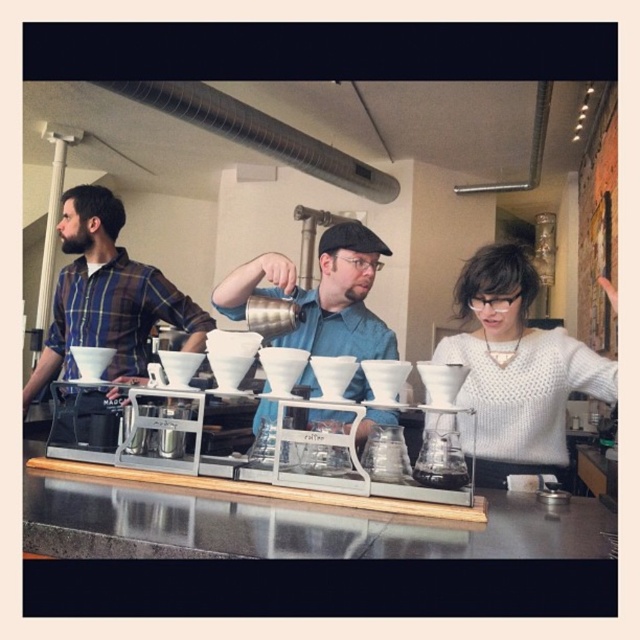
The width and height of the screenshot is (640, 640). What do you see at coordinates (321, 296) in the screenshot?
I see `matte silver kettle at center` at bounding box center [321, 296].

Does matte silver kettle at center have a greater height compared to black matte exhaust hood at upper center?

Indeed, matte silver kettle at center has a greater height compared to black matte exhaust hood at upper center.

The height and width of the screenshot is (640, 640). What do you see at coordinates (321, 296) in the screenshot?
I see `matte silver kettle at center` at bounding box center [321, 296].

Locate an element on the screen. The image size is (640, 640). matte silver kettle at center is located at coordinates (321, 296).

The height and width of the screenshot is (640, 640). What do you see at coordinates (332, 184) in the screenshot?
I see `transparent glass carafe at center` at bounding box center [332, 184].

Who is more forward, [225,209] or [392,330]?

Positioned in front is point [392,330].

Who is more distant from viewer, [460,227] or [236,289]?

The point [460,227] is behind.

Find the location of a particular element. The image size is (640, 640). transparent glass carafe at center is located at coordinates (332, 184).

Does point (438, 134) come closer to viewer compared to point (504, 378)?

No.

Which is in front, point (417, 100) or point (481, 458)?

Positioned in front is point (481, 458).

What do you see at coordinates (332, 184) in the screenshot? I see `transparent glass carafe at center` at bounding box center [332, 184].

Where is `transparent glass carafe at center`? The height and width of the screenshot is (640, 640). transparent glass carafe at center is located at coordinates (332, 184).